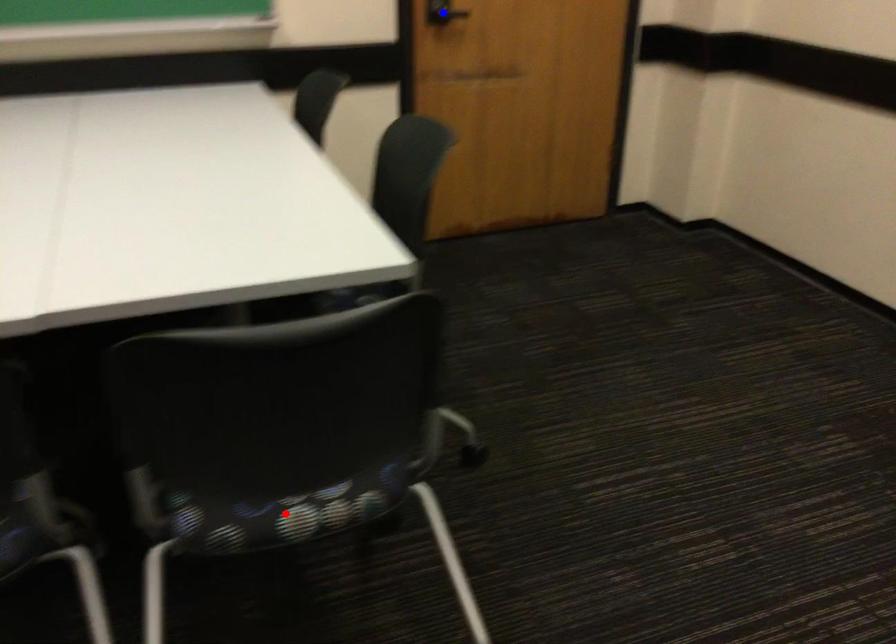
Question: Which of the two points in the image is closer to the camera?

Choices:
 (A) Blue point is closer.
 (B) Red point is closer.

Answer: (B)